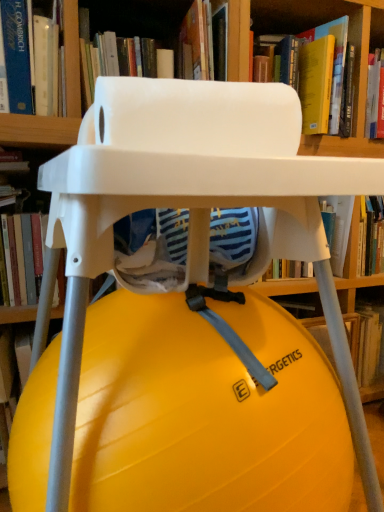
Question: Is blue hardcover book at upper left, marked as the 4th book in a right-to-left arrangement, in front of hardcover book at left, which is the first book in left-to-right order?

Choices:
 (A) yes
 (B) no

Answer: (A)

Question: From a real-world perspective, is blue hardcover book at upper left, marked as the 4th book in a right-to-left arrangement, positioned over hardcover book at left, which is the first book in left-to-right order, based on gravity?

Choices:
 (A) no
 (B) yes

Answer: (B)

Question: Could you tell me if blue hardcover book at upper left, which is counted as the second book, starting from the left, is facing hardcover book at left, which appears as the 5th book when viewed from the right?

Choices:
 (A) no
 (B) yes

Answer: (A)

Question: Is blue hardcover book at upper left, marked as the 4th book in a right-to-left arrangement, not close to hardcover book at left, which is the first book in left-to-right order?

Choices:
 (A) no
 (B) yes

Answer: (A)

Question: Is blue hardcover book at upper left, marked as the 4th book in a right-to-left arrangement, thinner than hardcover book at left, which appears as the 5th book when viewed from the right?

Choices:
 (A) no
 (B) yes

Answer: (B)

Question: Can you confirm if blue hardcover book at upper left, marked as the 4th book in a right-to-left arrangement, is bigger than hardcover book at left, which appears as the 5th book when viewed from the right?

Choices:
 (A) no
 (B) yes

Answer: (B)

Question: Does yellow matte exercise ball at center, the fifth book viewed from the left, come behind blue hardcover book at upper left, which is counted as the second book, starting from the left?

Choices:
 (A) no
 (B) yes

Answer: (B)

Question: Would you say blue hardcover book at upper left, which is counted as the second book, starting from the left, is part of yellow matte exercise ball at center, acting as the first book starting from the right,'s contents?

Choices:
 (A) yes
 (B) no

Answer: (B)

Question: Is yellow matte exercise ball at center, acting as the first book starting from the right, positioned far away from blue hardcover book at upper left, which is counted as the second book, starting from the left?

Choices:
 (A) no
 (B) yes

Answer: (A)

Question: Does yellow matte exercise ball at center, the fifth book viewed from the left, have a lesser height compared to blue hardcover book at upper left, which is counted as the second book, starting from the left?

Choices:
 (A) yes
 (B) no

Answer: (A)

Question: Is the position of yellow matte exercise ball at center, the fifth book viewed from the left, less distant than that of blue hardcover book at upper left, marked as the 4th book in a right-to-left arrangement?

Choices:
 (A) no
 (B) yes

Answer: (A)

Question: From a real-world perspective, is yellow matte exercise ball at center, the fifth book viewed from the left, beneath blue hardcover book at upper left, which is counted as the second book, starting from the left?

Choices:
 (A) yes
 (B) no

Answer: (A)

Question: Is yellow rubber ball at center touching blue hardcover book at upper left, which is counted as the second book, starting from the left?

Choices:
 (A) no
 (B) yes

Answer: (A)